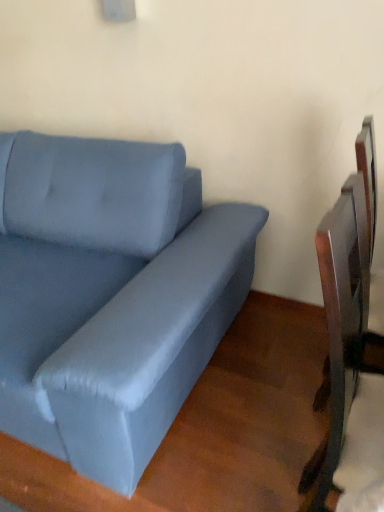
This screenshot has height=512, width=384. Identify the location of free space to the back side of metallic silver swivel chair at right. (296, 344).